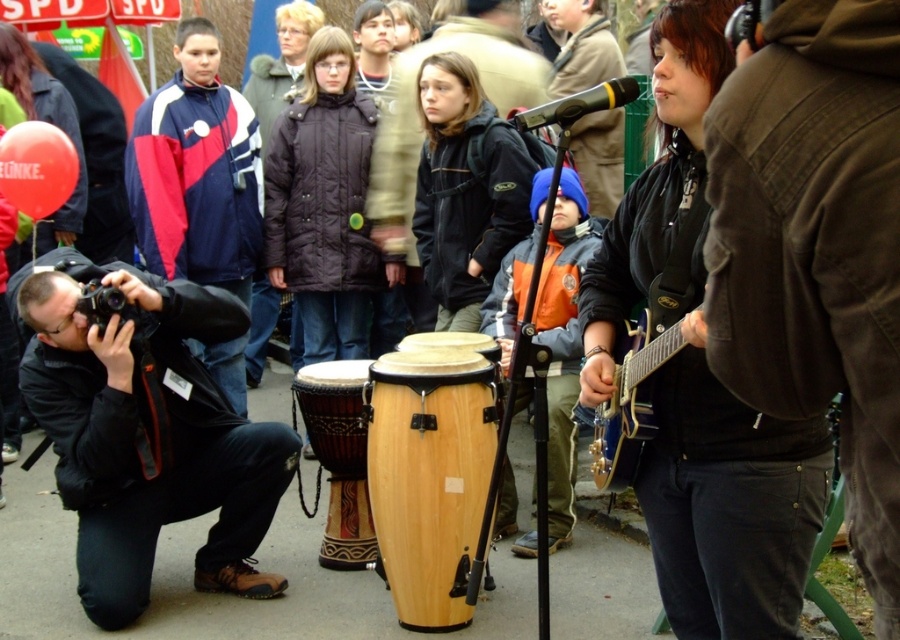
You are standing at the point labeled as point (384, 189) and want to walk towards the point labeled as point (166, 465). Which direction should you face to move directly towards your destination?

You should face forward because point (166, 465) is in front of point (384, 189).

You are standing at the center of the event area and want to move towards the two points marked in the scene. Which point, point (487, 381) or point (231, 156), is closer to you?

Point (487, 381) is closer to the viewer than point (231, 156), so you should move towards point (487, 381) first.

You are a photographer at the event and need to place a small tripod between the wooden drum at center and the glossy wood guitar at right. Which side of the drum should you place it closer to so it doesn

The wooden drum at center is bigger than the glossy wood guitar at right, so you should place the tripod closer to the glossy wood guitar at right to ensure enough space around the larger drum.